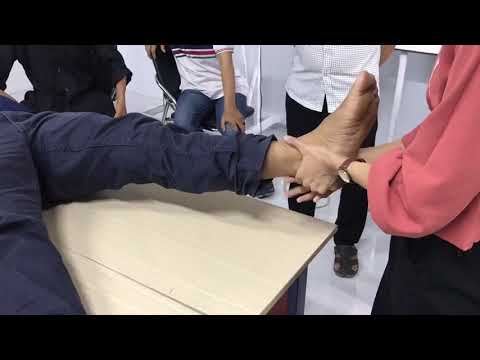
Where is `chair`? This screenshot has width=480, height=360. chair is located at coordinates (165, 95).